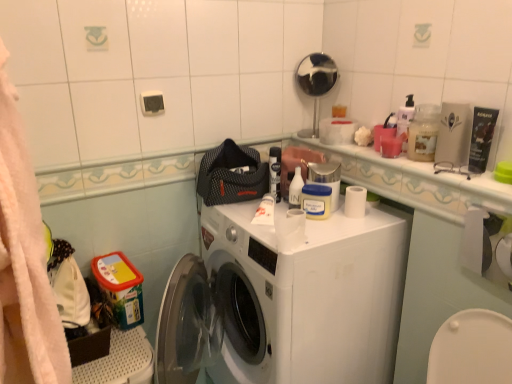
Question: Can you confirm if translucent plastic container at upper right is positioned to the left of pink matte candle at upper right, the fourth toiletry when ordered from left to right?

Choices:
 (A) yes
 (B) no

Answer: (B)

Question: From the image's perspective, is translucent plastic container at upper right beneath pink matte candle at upper right, the second toiletry when ordered from right to left?

Choices:
 (A) yes
 (B) no

Answer: (B)

Question: From a real-world perspective, is translucent plastic container at upper right positioned over pink matte candle at upper right, the fourth toiletry when ordered from left to right, based on gravity?

Choices:
 (A) yes
 (B) no

Answer: (A)

Question: Are translucent plastic container at upper right and pink matte candle at upper right, the second toiletry when ordered from right to left, far apart?

Choices:
 (A) no
 (B) yes

Answer: (A)

Question: Is translucent plastic container at upper right looking in the opposite direction of pink matte candle at upper right, the fourth toiletry when ordered from left to right?

Choices:
 (A) yes
 (B) no

Answer: (B)

Question: Is translucent plastic container at upper right in contact with pink matte candle at upper right, the fourth toiletry when ordered from left to right?

Choices:
 (A) no
 (B) yes

Answer: (B)

Question: Would you say yellow matte jar at center, the second toiletry viewed from the left, is outside translucent plastic cup at upper right, which is the third toiletry from right to left?

Choices:
 (A) no
 (B) yes

Answer: (B)

Question: Is yellow matte jar at center, which is counted as the 4th toiletry, starting from the right, thinner than translucent plastic cup at upper right, which is the third toiletry from right to left?

Choices:
 (A) yes
 (B) no

Answer: (B)

Question: Considering the relative sizes of yellow matte jar at center, which is counted as the 4th toiletry, starting from the right, and translucent plastic cup at upper right, marked as the 3th toiletry in a left-to-right arrangement, in the image provided, is yellow matte jar at center, which is counted as the 4th toiletry, starting from the right, wider than translucent plastic cup at upper right, marked as the 3th toiletry in a left-to-right arrangement,?

Choices:
 (A) yes
 (B) no

Answer: (A)

Question: From the image's perspective, is yellow matte jar at center, which is counted as the 4th toiletry, starting from the right, above translucent plastic cup at upper right, marked as the 3th toiletry in a left-to-right arrangement?

Choices:
 (A) no
 (B) yes

Answer: (A)

Question: Considering the relative sizes of yellow matte jar at center, the second toiletry viewed from the left, and translucent plastic cup at upper right, marked as the 3th toiletry in a left-to-right arrangement, in the image provided, is yellow matte jar at center, the second toiletry viewed from the left, bigger than translucent plastic cup at upper right, marked as the 3th toiletry in a left-to-right arrangement,?

Choices:
 (A) yes
 (B) no

Answer: (A)

Question: From the image's perspective, would you say yellow matte jar at center, which is counted as the 4th toiletry, starting from the right, is shown under translucent plastic cup at upper right, which is the third toiletry from right to left?

Choices:
 (A) no
 (B) yes

Answer: (B)

Question: From the image's perspective, is matte black tube at upper right, marked as the first toiletry in a right-to-left arrangement, located beneath white plastic bottle at upper center, arranged as the 5th toiletry when viewed from the right?

Choices:
 (A) no
 (B) yes

Answer: (A)